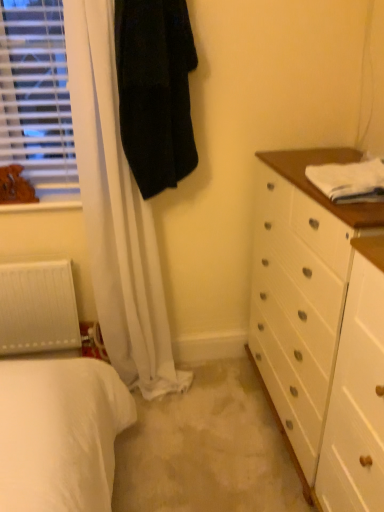
Question: In terms of size, does white cotton towel at upper right appear bigger or smaller than brown leather dog at left?

Choices:
 (A) small
 (B) big

Answer: (B)

Question: In terms of width, does white cotton towel at upper right look wider or thinner when compared to brown leather dog at left?

Choices:
 (A) wide
 (B) thin

Answer: (A)

Question: Which is farther from the wooden frame at left?

Choices:
 (A) white matte radiator at lower left
 (B) white cotton towel at upper right
 (C) black fuzzy coat at upper left
 (D) brown leather dog at left

Answer: (B)

Question: Estimate the real-world distances between objects in this image. Which object is closer to the white cotton towel at upper right?

Choices:
 (A) wooden frame at left
 (B) white matte radiator at lower left
 (C) black fuzzy coat at upper left
 (D) brown leather dog at left

Answer: (C)